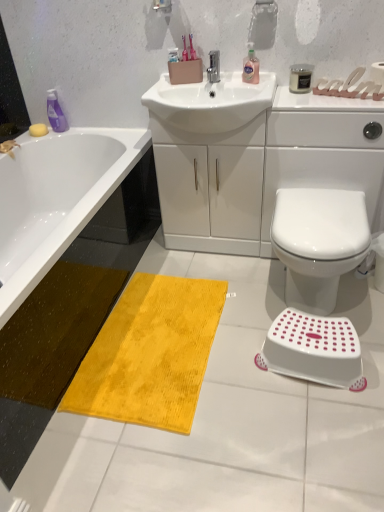
This screenshot has height=512, width=384. I want to click on free point to the right of purple plastic bottle at upper left, the second cleaning product viewed from the front, so point(89,131).